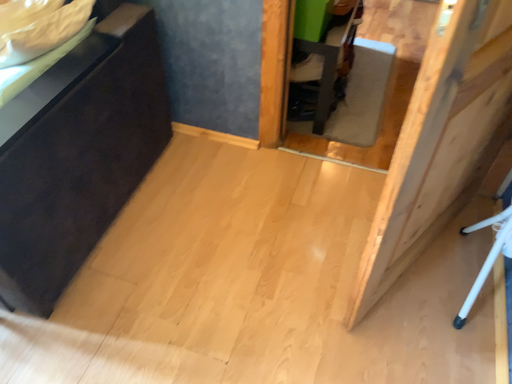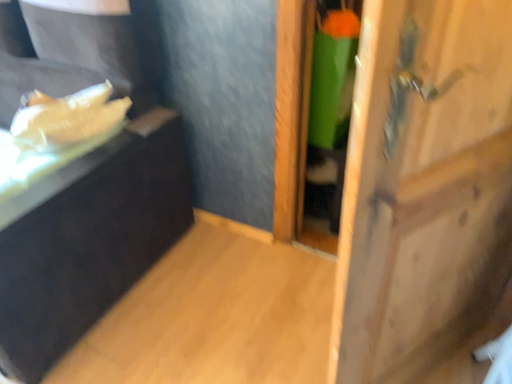
Question: How did the camera likely rotate when shooting the video?

Choices:
 (A) rotated downward
 (B) rotated upward

Answer: (B)